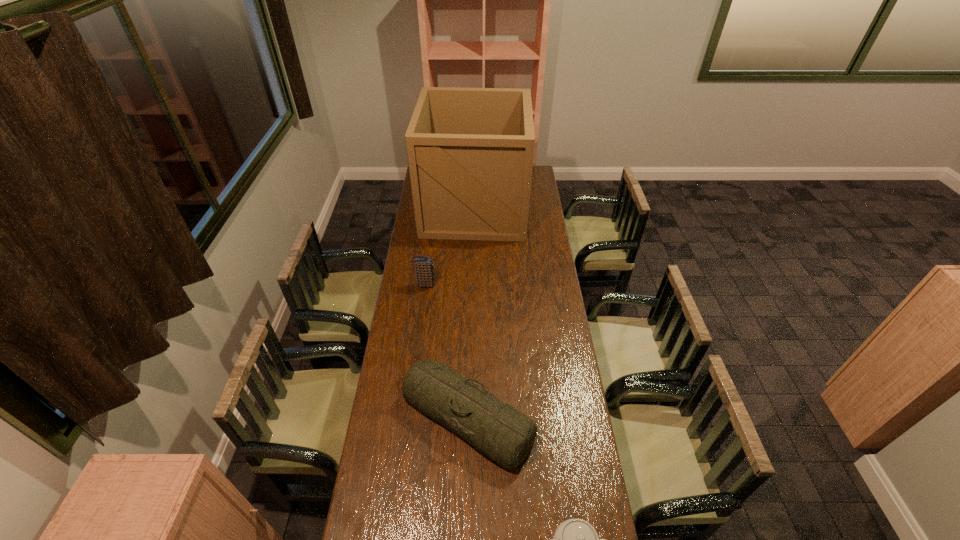
The image size is (960, 540). What are the coordinates of `box` in the screenshot? It's located at (470, 151).

In order to click on the tallest object in this screenshot , I will do `click(470, 151)`.

The image size is (960, 540). Identify the location of clutch bag. (424, 273).

Find the location of a particular element. This screenshot has width=960, height=540. duffel bag is located at coordinates click(x=498, y=430).

Locate an element on the screen. The width and height of the screenshot is (960, 540). blank area located on the back of the box is located at coordinates tap(475, 167).

Locate an element on the screen. The width and height of the screenshot is (960, 540). vacant space located 0.290m with the zip open on the clutch bag is located at coordinates (497, 285).

Locate an element on the screen. This screenshot has height=540, width=960. vacant region located on the right of the second nearest object is located at coordinates (570, 417).

This screenshot has height=540, width=960. I want to click on object that is positioned at the far edge, so click(470, 151).

At what (x,y) coordinates should I click in order to perform the action: click on box situated at the left edge. Please return your answer as a coordinate pair (x, y). Image resolution: width=960 pixels, height=540 pixels. Looking at the image, I should click on (470, 151).

I want to click on clutch bag that is at the left edge, so click(x=424, y=273).